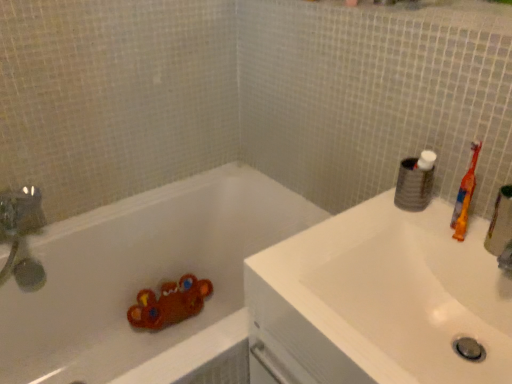
Question: Can you confirm if white glossy sink at upper right is bigger than white matte toilet paper at upper right?

Choices:
 (A) no
 (B) yes

Answer: (B)

Question: Is white glossy sink at upper right completely or partially outside of white matte toilet paper at upper right?

Choices:
 (A) no
 (B) yes

Answer: (B)

Question: Can you confirm if white glossy sink at upper right is taller than white matte toilet paper at upper right?

Choices:
 (A) yes
 (B) no

Answer: (A)

Question: Is white glossy sink at upper right to the right of white matte toilet paper at upper right from the viewer's perspective?

Choices:
 (A) no
 (B) yes

Answer: (A)

Question: From the image's perspective, does white glossy sink at upper right appear lower than white matte toilet paper at upper right?

Choices:
 (A) yes
 (B) no

Answer: (A)

Question: Considering their positions, is white matte toilet paper at upper right located in front of or behind orange plastic toothbrush at right?

Choices:
 (A) behind
 (B) front

Answer: (A)

Question: Based on their sizes in the image, would you say white matte toilet paper at upper right is bigger or smaller than orange plastic toothbrush at right?

Choices:
 (A) small
 (B) big

Answer: (B)

Question: Would you say white matte toilet paper at upper right is inside or outside orange plastic toothbrush at right?

Choices:
 (A) inside
 (B) outside

Answer: (B)

Question: Is white matte toilet paper at upper right taller or shorter than orange plastic toothbrush at right?

Choices:
 (A) tall
 (B) short

Answer: (B)

Question: Is point (408, 173) closer or farther from the camera than point (328, 314)?

Choices:
 (A) closer
 (B) farther

Answer: (B)

Question: Would you say white matte toilet paper at upper right is to the left or to the right of white glossy sink at upper right in the picture?

Choices:
 (A) left
 (B) right

Answer: (B)

Question: In terms of size, does white matte toilet paper at upper right appear bigger or smaller than white glossy sink at upper right?

Choices:
 (A) big
 (B) small

Answer: (B)

Question: From a real-world perspective, is white matte toilet paper at upper right above or below white glossy sink at upper right?

Choices:
 (A) below
 (B) above

Answer: (B)

Question: Is white matte bathtub at lower left taller or shorter than white glossy sink at upper right?

Choices:
 (A) short
 (B) tall

Answer: (B)

Question: Would you say white matte bathtub at lower left is inside or outside white glossy sink at upper right?

Choices:
 (A) outside
 (B) inside

Answer: (A)